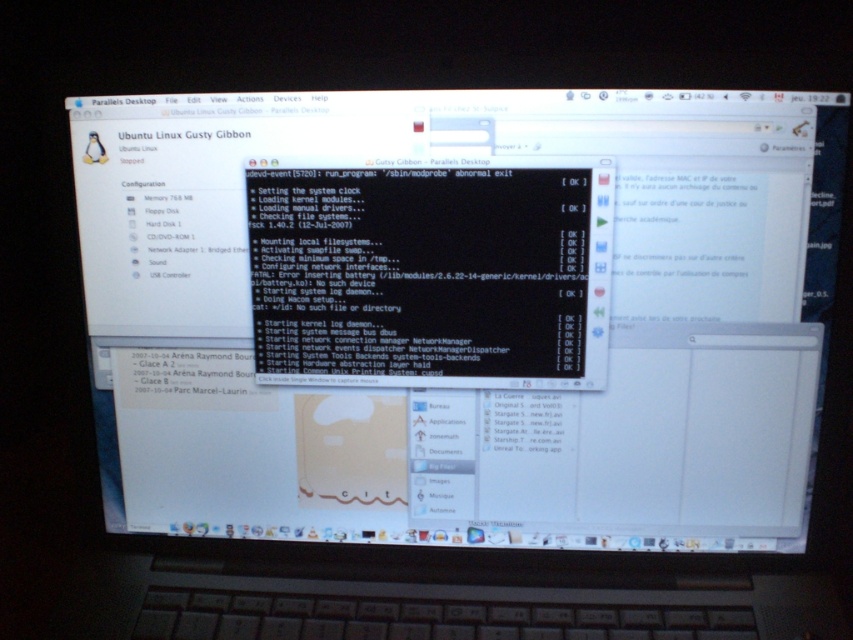
Question: Does black glossy terminal at center appear on the right side of black glossy text at center?

Choices:
 (A) no
 (B) yes

Answer: (B)

Question: Among these points, which one is farthest from the camera?

Choices:
 (A) (457, 260)
 (B) (314, 340)

Answer: (B)

Question: Which object appears farthest from the camera in this image?

Choices:
 (A) black glossy text at center
 (B) black glossy terminal at center

Answer: (A)

Question: Observing the image, what is the correct spatial positioning of black glossy terminal at center in reference to black glossy text at center?

Choices:
 (A) right
 (B) left

Answer: (A)

Question: Does black glossy terminal at center have a greater width compared to black glossy text at center?

Choices:
 (A) yes
 (B) no

Answer: (A)